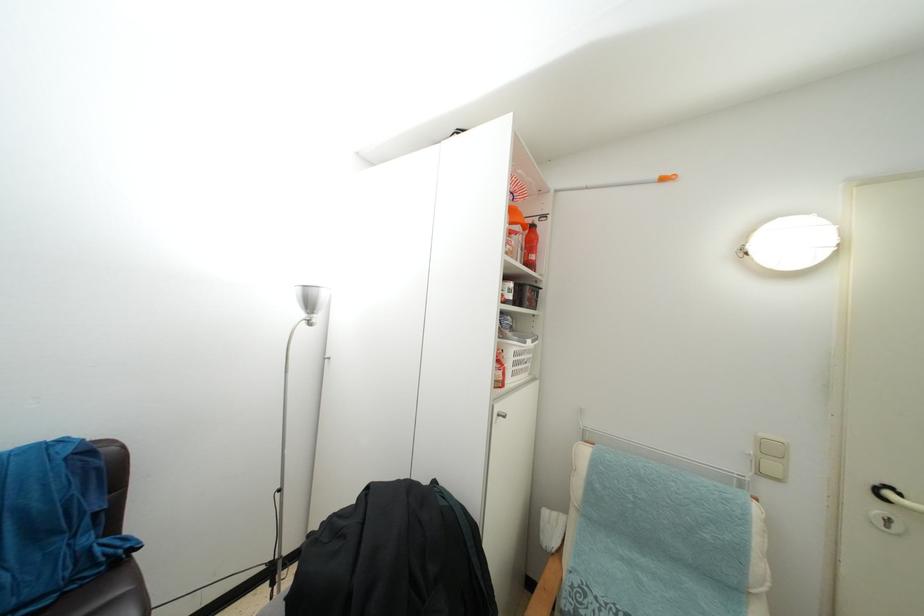
Find where to turn the white door handle. Please return your answer as a coordinate pair (x, y).

(896, 498)